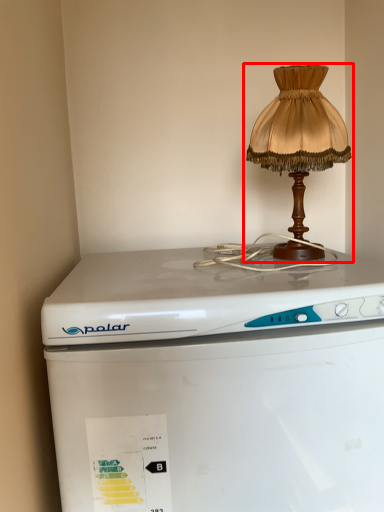
Question: In this image, where is lamp (annotated by the red box) located relative to home appliance?

Choices:
 (A) right
 (B) left

Answer: (A)